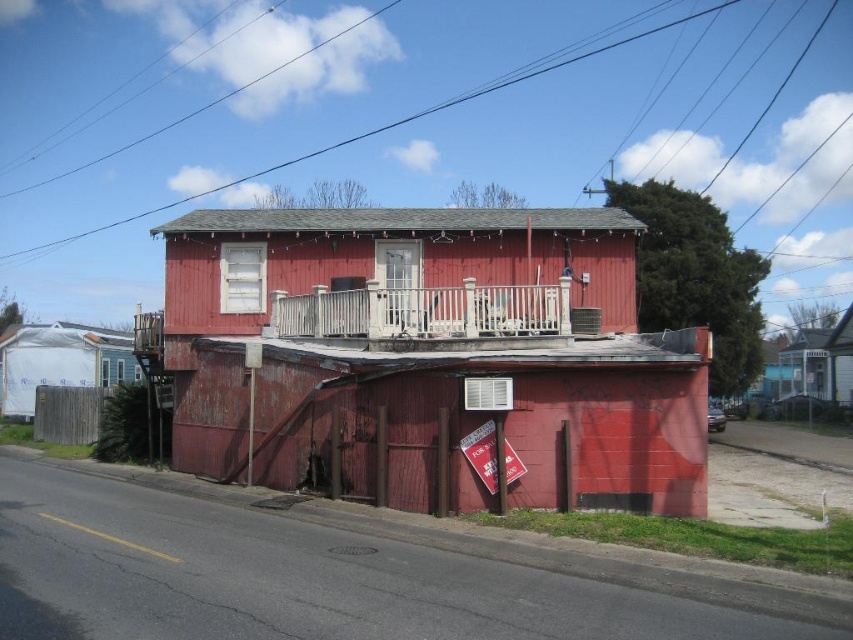
You are standing on the sidewalk in front of the two story red building. You see a rusty wood hut at center and a white plastic tarp at left. Which object is closer to you?

The rusty wood hut at center is closer to you because it is in front of the white plastic tarp at left.

In the scene shown: You are standing at the entrance of the two story red building. You want to go to the rusty wood hut at center. Which direction should you go?

The rusty wood hut at center is located at point (431, 356), so you should go towards the center of the image to reach it.